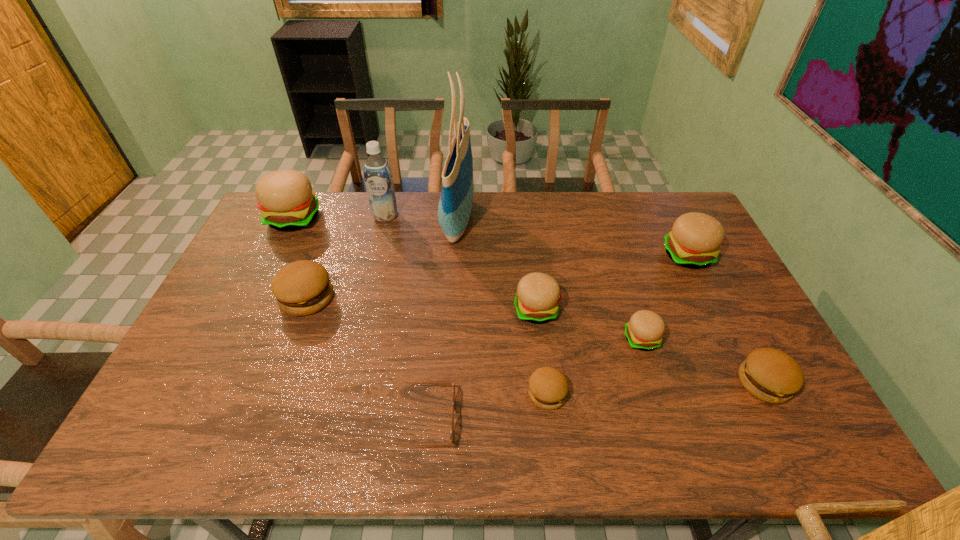
Locate an element on the screen. This screenshot has width=960, height=540. vacant space located 0.150m on the front of the farthest beige hamburger is located at coordinates (272, 265).

What are the coordinates of `vacant space located on the front of the second farthest beige hamburger` in the screenshot? It's located at (731, 341).

In order to click on vacant space located 0.300m on the left of the third beige hamburger from right to left in this screenshot , I will do `click(411, 310)`.

Locate an element on the screen. free space located 0.250m on the front of the farthest brown hamburger is located at coordinates (270, 396).

Locate an element on the screen. This screenshot has height=540, width=960. vacant space located on the back of the second biggest brown hamburger is located at coordinates (736, 328).

The height and width of the screenshot is (540, 960). What are the coordinates of `vacant space located on the left of the fifth hamburger from left to right` in the screenshot? It's located at (562, 339).

What are the coordinates of `vacant space situated 0.370m on the left of the shortest hamburger` in the screenshot? It's located at coord(379,394).

The image size is (960, 540). Find the location of `vacant space located 0.090m on the front-facing side of the shortest object`. vacant space located 0.090m on the front-facing side of the shortest object is located at coordinates (492, 420).

At what (x,y) coordinates should I click in order to perform the action: click on tote bag that is at the far edge. Please return your answer as a coordinate pair (x, y). Looking at the image, I should click on (456, 200).

At what (x,y) coordinates should I click in order to perform the action: click on soya milk that is at the far edge. Please return your answer as a coordinate pair (x, y). This screenshot has width=960, height=540. Looking at the image, I should click on (377, 171).